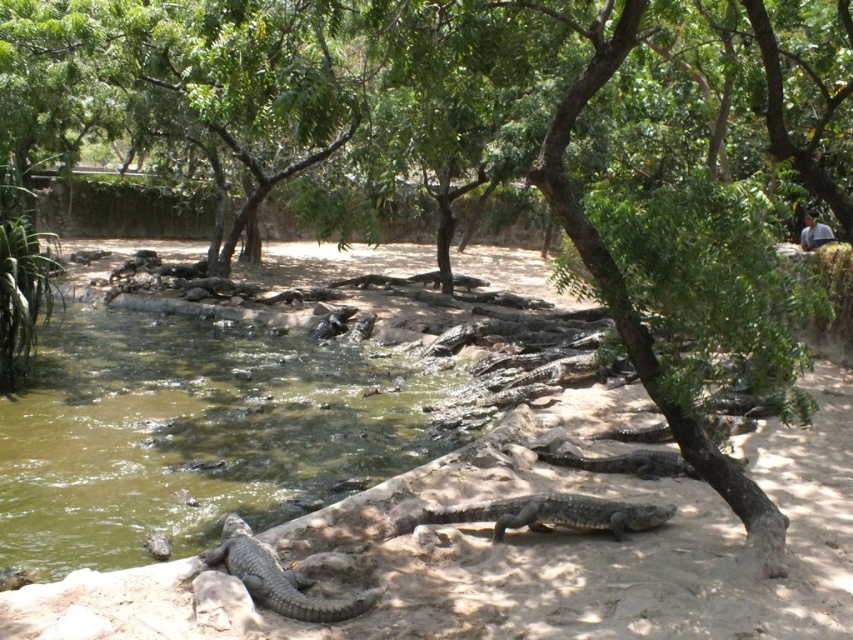
What do you see at coordinates (196, 433) in the screenshot?
I see `greenish murky water at center` at bounding box center [196, 433].

Is point (39, 493) behind point (625, 518)?

That is True.

At what (x,y) coordinates should I click in order to perform the action: click on greenish murky water at center. Please return your answer as a coordinate pair (x, y). This screenshot has width=853, height=640. Looking at the image, I should click on (196, 433).

Is the position of dark gray textured crocodile at center more distant than that of gray scaly crocodile at lower left?

Yes, dark gray textured crocodile at center is further from the viewer.

Where is `dark gray textured crocodile at center`? dark gray textured crocodile at center is located at coordinates (538, 515).

You are a GUI agent. You are given a task and a screenshot of the screen. Output one action in this format:
    pyautogui.click(x=<x>, y=<y>)
    Task: Click on the dark gray textured crocodile at center
    This screenshot has height=640, width=853.
    Given the screenshot: What is the action you would take?
    (538, 515)

Locate an element on the screen. The width and height of the screenshot is (853, 640). dark gray textured crocodile at center is located at coordinates (x=538, y=515).

Measure the distance between greenish murky water at center and gray scaly crocodile at lower left.

3.41 meters

Who is shorter, greenish murky water at center or gray scaly crocodile at lower left?

With less height is gray scaly crocodile at lower left.

Is point (18, 396) behind point (236, 544)?

Yes, it is behind point (236, 544).

I want to click on greenish murky water at center, so click(196, 433).